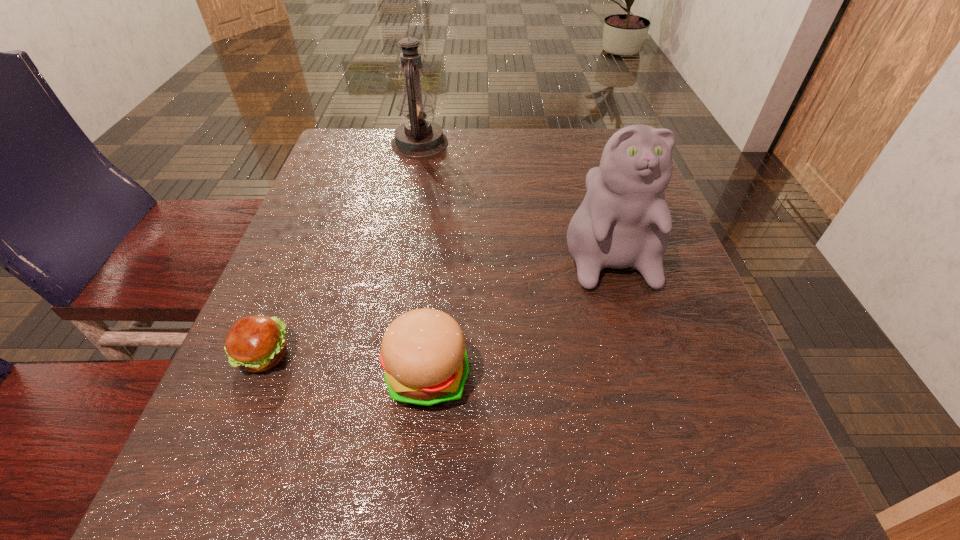
Locate an element on the screen. free region that satisfies the following two spatial constraints: 1. on the front side of the third tallest object; 2. on the right side of the left hamburger is located at coordinates point(255,376).